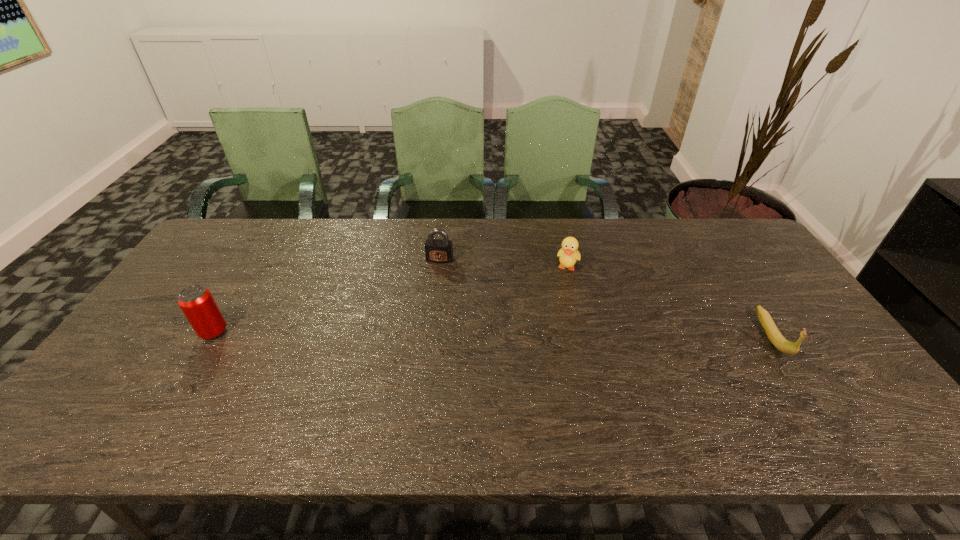
At what (x,y) coordinates should I click in order to perform the action: click on free space located on the front of the padlock near the keyhole. Please return your answer as a coordinate pair (x, y). Looking at the image, I should click on (424, 313).

The image size is (960, 540). I want to click on free region located on the front of the padlock near the keyhole, so click(x=434, y=276).

Find the location of a particular element. This screenshot has width=960, height=540. vacant space located on the front of the padlock near the keyhole is located at coordinates (417, 340).

I want to click on duckling that is at the far edge, so click(x=568, y=256).

Find the location of a particular element. The width and height of the screenshot is (960, 540). padlock present at the far edge is located at coordinates (436, 250).

Identify the location of object that is at the left edge. (196, 302).

What are the coordinates of `object situated at the right edge` in the screenshot? It's located at (772, 332).

In the image, there is a desktop. At what (x,y) coordinates should I click in order to perform the action: click on vacant space at the far edge. Please return your answer as a coordinate pair (x, y). Looking at the image, I should click on (458, 220).

Locate an element on the screen. This screenshot has width=960, height=540. free space at the near edge of the desktop is located at coordinates (212, 390).

The width and height of the screenshot is (960, 540). What are the coordinates of `free spot at the right edge of the desktop` in the screenshot? It's located at (737, 279).